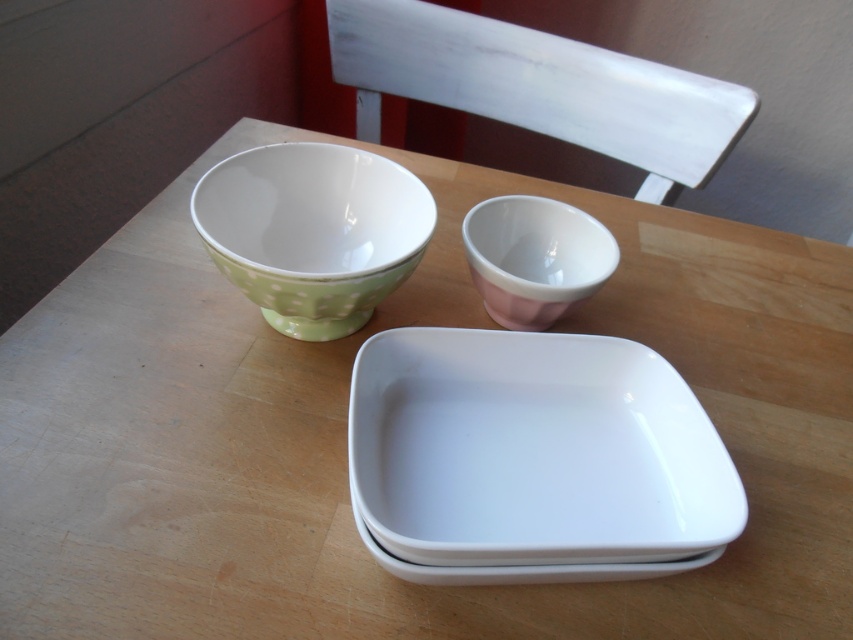
You are arranging dishes on a table and need to place a new dish between the green polka dot porcelain bowl at upper left and the pink glossy cup at upper center. According to their positions, which object should the new dish be placed closer to?

The new dish should be placed closer to the pink glossy cup at upper center because the green polka dot porcelain bowl at upper left is in front of it, meaning the cup is further back.

From the picture: You are arranging items on a wooden table. You have a white glossy tray at center and a pink glossy cup at upper center. Which item is located to the left of the other?

The white glossy tray at center is positioned on the left side of the pink glossy cup at upper center.

You are setting up a tea service on the wooden table. You have a white glossy tray at center and a pink glossy cup at upper center. Where should you place the cup relative to the tray to maintain the arrangement shown?

The pink glossy cup at upper center should be placed above the white glossy tray at center since the white glossy tray at center is below the pink glossy cup at upper center in the image.